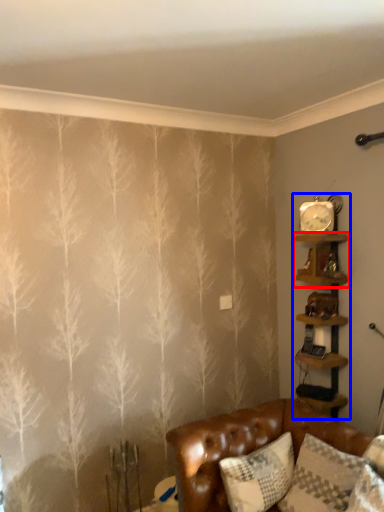
Question: Which of the following is the farthest to the observer, shelf (highlighted by a red box) or shelf (highlighted by a blue box)?

Choices:
 (A) shelf
 (B) shelf

Answer: (B)